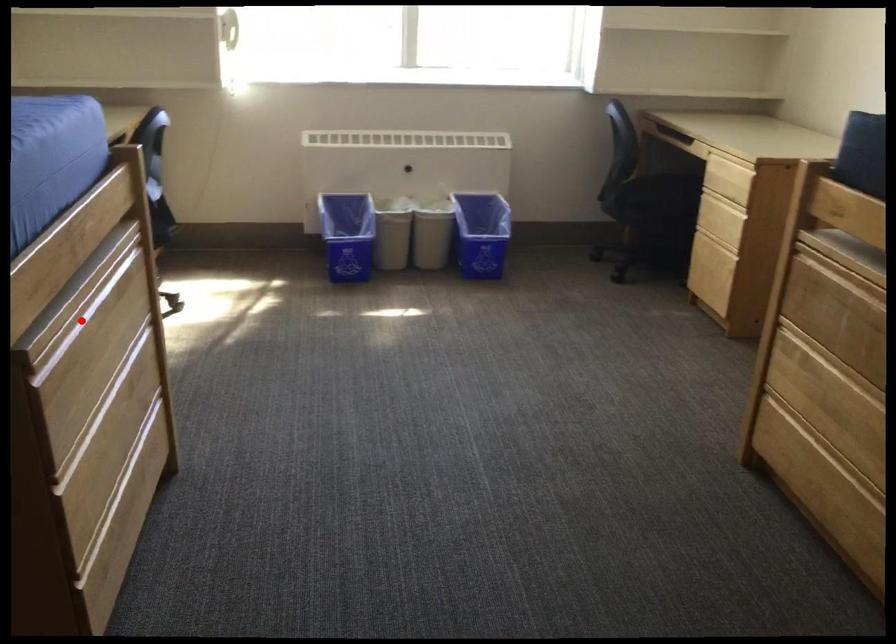
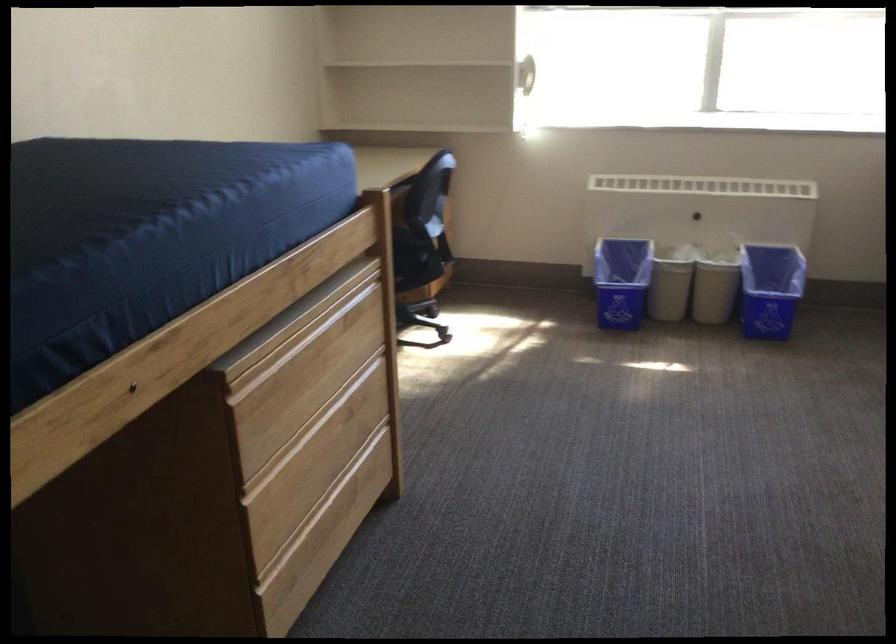
Find the pixel in the second image that matches the highlighted location in the first image.

(296, 346)